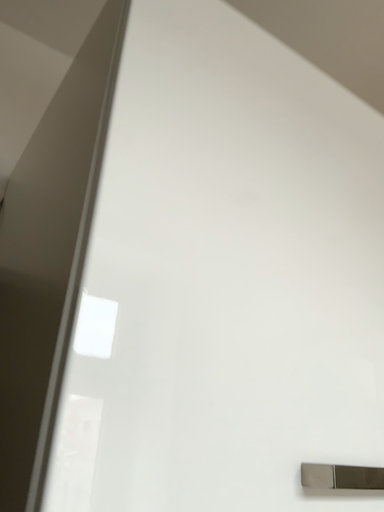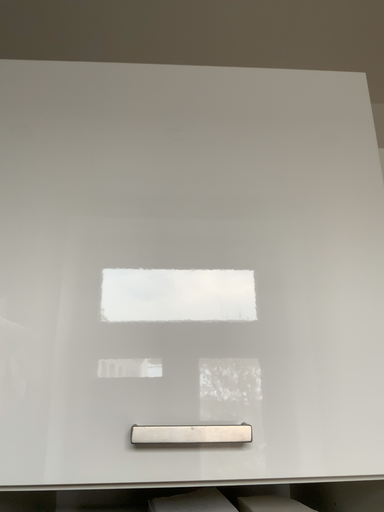
Question: Which way did the camera rotate in the video?

Choices:
 (A) rotated left
 (B) rotated right

Answer: (A)